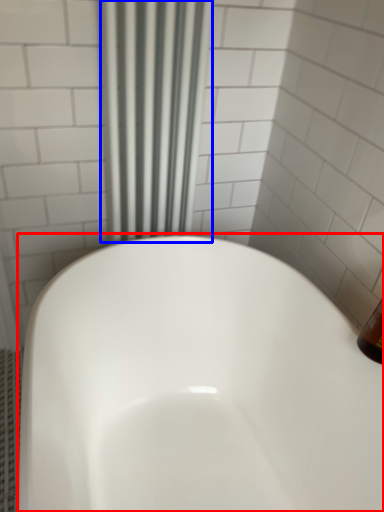
Question: Which of the following is the farthest to the observer, bathtub (highlighted by a red box) or shower curtain (highlighted by a blue box)?

Choices:
 (A) bathtub
 (B) shower curtain

Answer: (B)